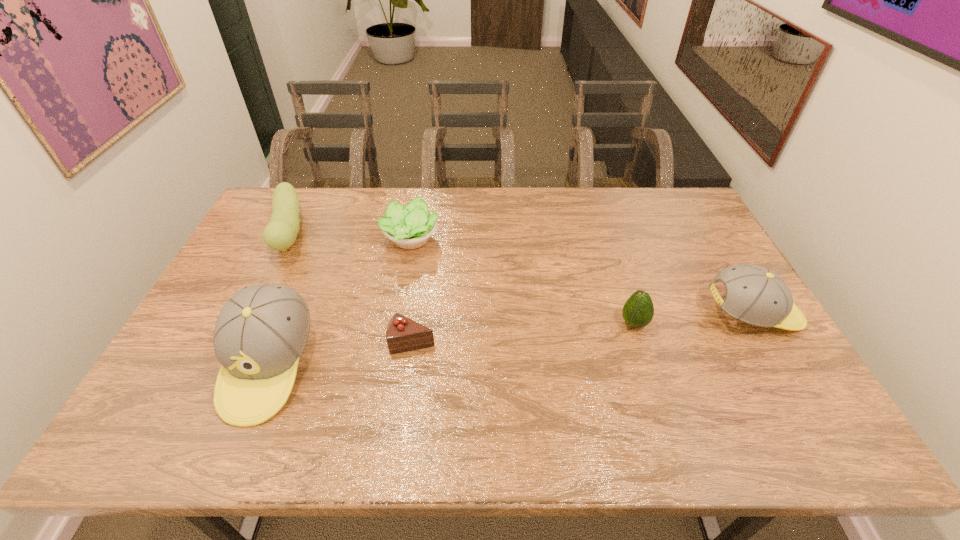
The height and width of the screenshot is (540, 960). Identify the location of the tallest object. (261, 332).

Identify the location of the taller baseball cap. point(261,332).

Locate an element on the screen. The height and width of the screenshot is (540, 960). the right baseball cap is located at coordinates click(x=755, y=295).

This screenshot has width=960, height=540. Identify the location of the second tallest object. (755, 295).

Identify the location of cucumber. (281, 232).

At what (x,y) coordinates should I click in order to perform the action: click on chocolate cake. Please return your answer as a coordinate pair (x, y). Looking at the image, I should click on (403, 334).

Where is `lettuce`? The width and height of the screenshot is (960, 540). lettuce is located at coordinates (409, 227).

You are a GUI agent. You are given a task and a screenshot of the screen. Output one action in this format:
    pyautogui.click(x=<x>, y=<y>)
    Task: Click on the fifth object from left to right
    The image size is (960, 540).
    Given the screenshot: What is the action you would take?
    pyautogui.click(x=638, y=311)

The height and width of the screenshot is (540, 960). Find the location of `vacant area situated on the right of the cucumber`. vacant area situated on the right of the cucumber is located at coordinates (407, 233).

In order to click on free space located on the left of the shortest object in this screenshot , I will do `click(242, 342)`.